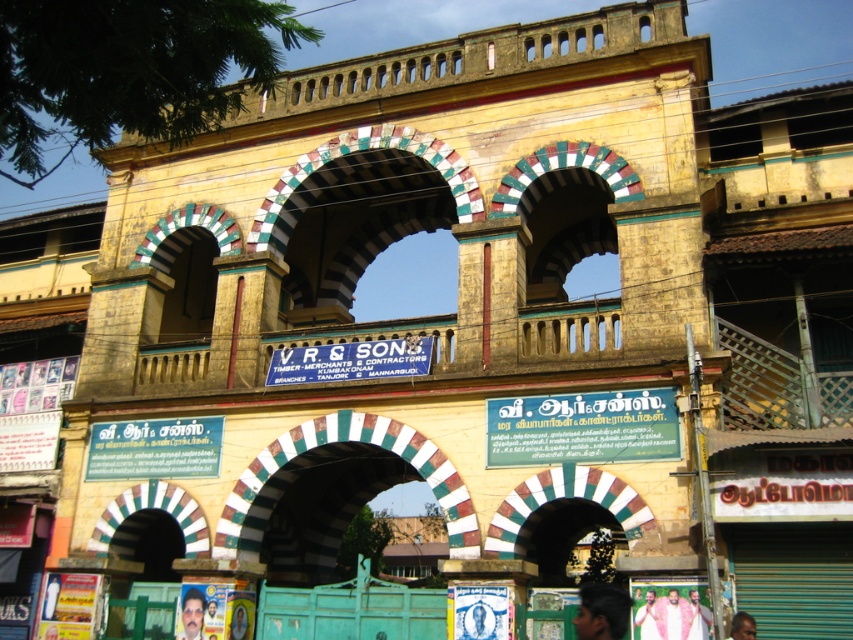
You are standing in front of a historic building with two features visible from your current position. There is a light brown wooden person at center and a smooth skin face at center. If you want to reach both features, which one would require walking further away from your current position?

The light brown wooden person at center is 20.30 meters away from the smooth skin face at center. Since you are standing in front of the building, you would need to walk further away to reach the light brown wooden person at center if it is positioned behind the smooth skin face at center. However, without knowing the exact positioning of both features relative to your current location, it is difficult to determine which requires more distance. The given distance between them is 20.30 meters, but your own v

Based on the scene description, which object is wider, the white painted stone archway at center or the light pink fabric at center?

The white painted stone archway at center is wider than the light pink fabric at center according to the description.